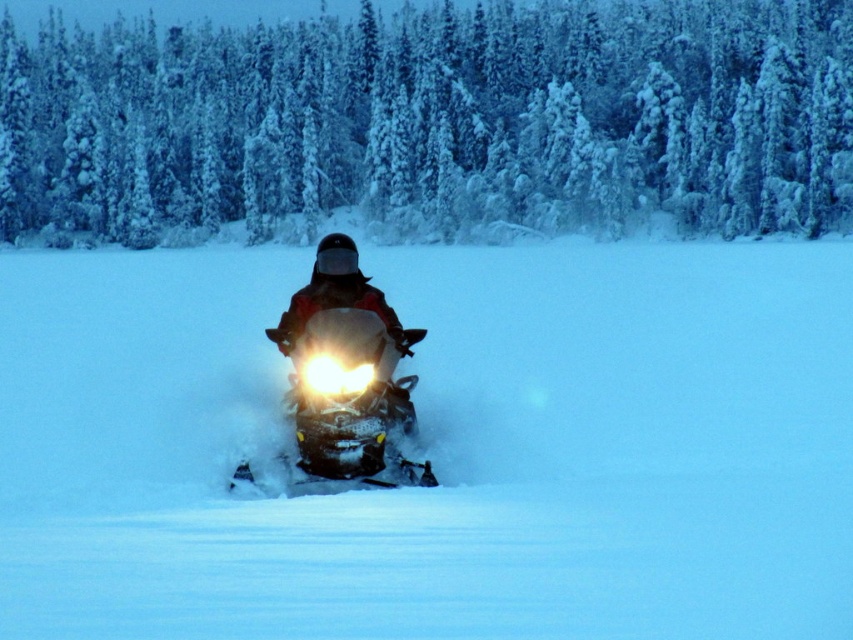
You are standing at the origin point of the coordinate system in this winter scene. You want to move towards the white powdery snow at center. Which direction should you move in terms of x and y coordinates?

Result: The white powdery snow at center is located at the coordinate point of 0.700 in the x direction and 0.513 in the y direction, so you should move towards increasing x and y coordinates to reach it.